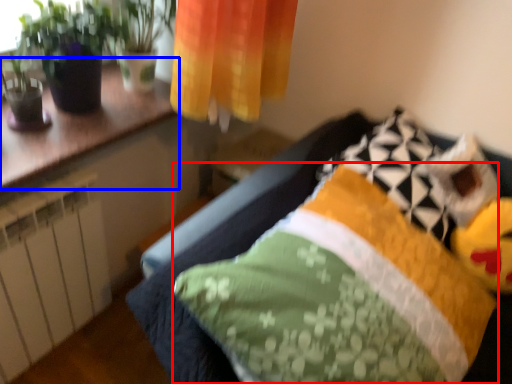
Question: Which object is closer to the camera taking this photo, pillow (highlighted by a red box) or counter top (highlighted by a blue box)?

Choices:
 (A) pillow
 (B) counter top

Answer: (A)